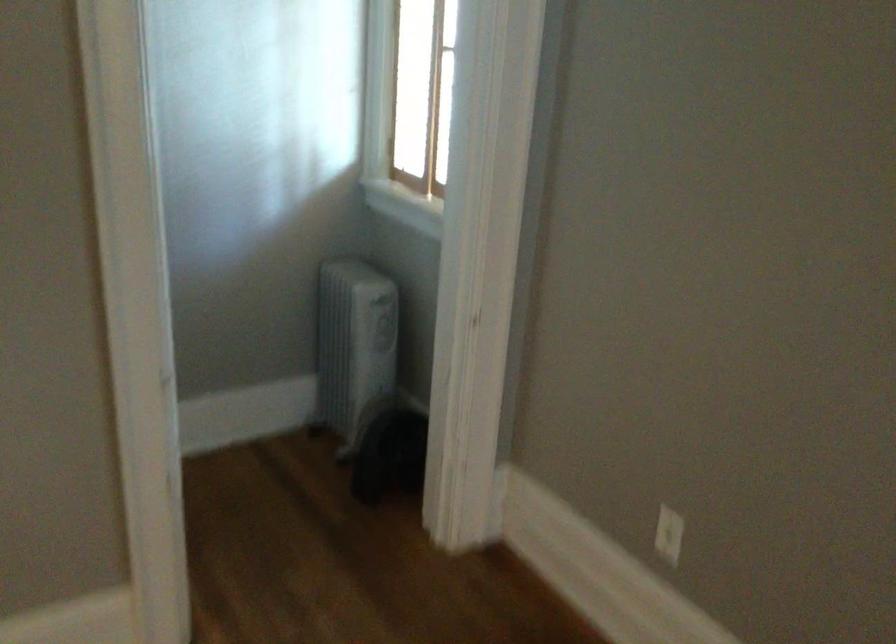
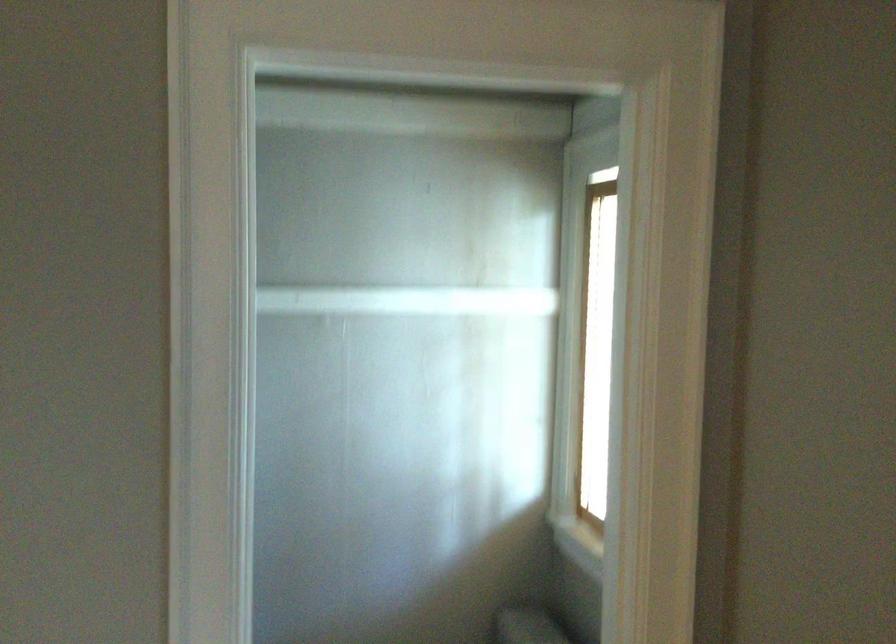
In a continuous first-person perspective shot, in which direction is the camera moving?

The cameraman walked toward right, forward.